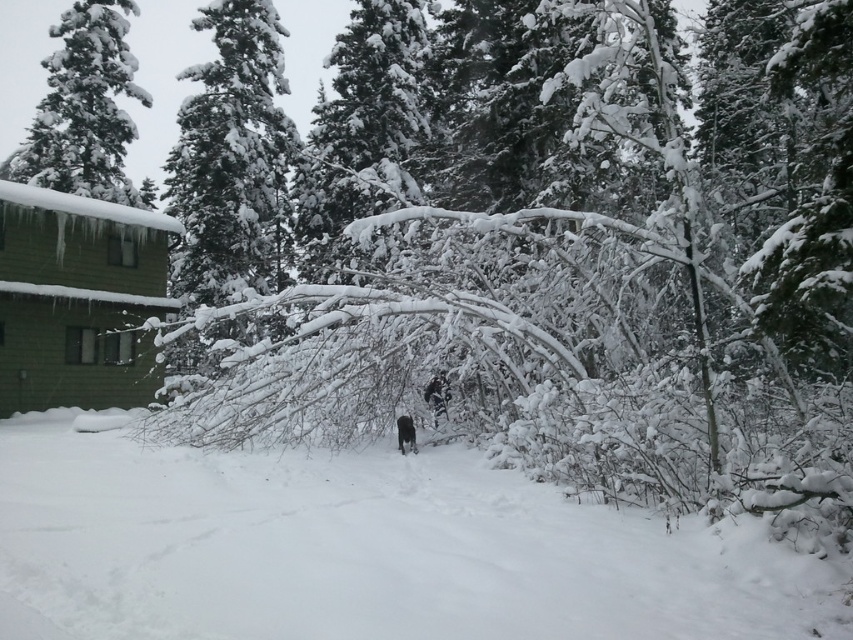
Looking at this image, is white fluffy snow at center below black fur coat at center?

Actually, white fluffy snow at center is above black fur coat at center.

Does white fluffy snow at center have a greater width compared to black fur coat at center?

Yes.

Is point (415, 616) closer to camera compared to point (415, 435)?

Yes, point (415, 616) is closer to viewer.

Where is `white fluffy snow at center`? This screenshot has height=640, width=853. white fluffy snow at center is located at coordinates (364, 550).

Does white fluffy snow at center have a lesser height compared to snow-covered pine tree at upper left?

Yes, white fluffy snow at center is shorter than snow-covered pine tree at upper left.

How far apart are white fluffy snow at center and snow-covered pine tree at upper left?

white fluffy snow at center and snow-covered pine tree at upper left are 33.83 meters apart from each other.

What are the coordinates of `white fluffy snow at center` in the screenshot? It's located at (364, 550).

Find the location of a particular element. white fluffy snow at center is located at coordinates (364, 550).

Does snow-covered pine tree at upper left lie in front of black fabric person at center?

No, snow-covered pine tree at upper left is further to the viewer.

Between snow-covered pine tree at upper left and black fabric person at center, which one appears on the left side from the viewer's perspective?

Positioned to the left is snow-covered pine tree at upper left.

Between point (67, 108) and point (442, 380), which one is positioned in front?

Point (442, 380) is more forward.

Where is `snow-covered pine tree at upper left`? The image size is (853, 640). snow-covered pine tree at upper left is located at coordinates (84, 108).